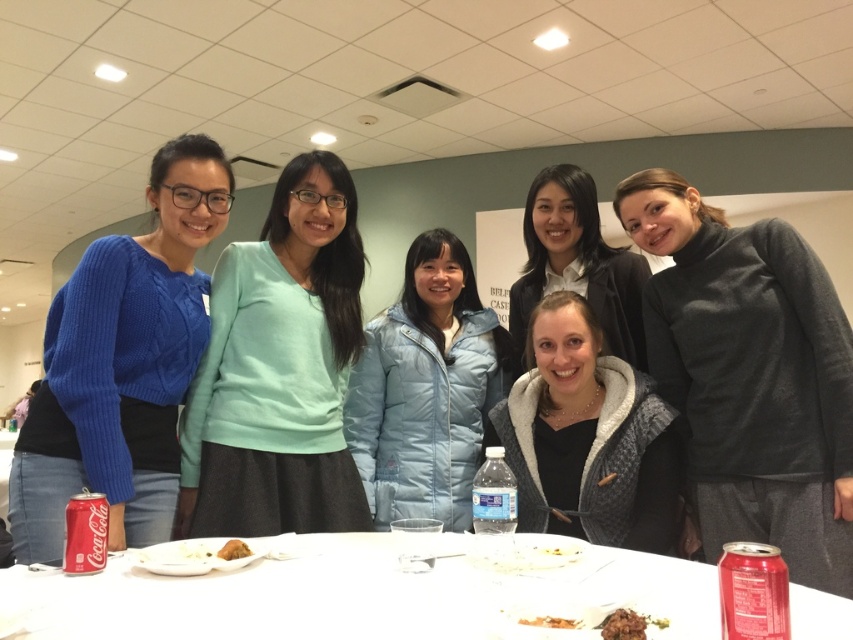
You are trying to identify the person wearing the dark gray turtleneck sweater at center. Based on their position relative to the light blue puffer jacket at center, where would you find them?

The dark gray turtleneck sweater at center is positioned on the right side of the light blue puffer jacket at center, so you would find them to the right of the light blue puffer jacket at center.

You are standing in front of the group of six people. You need to hand a gift to the person wearing the matte white shirt at center. Which direction should you move to reach them first, considering the light blue puffer jacket at center is blocking your view?

The light blue puffer jacket at center is closer to the viewer than the matte white shirt at center. To reach the matte white shirt at center, you should move around the light blue puffer jacket at center since it is blocking the direct path.

You are standing in front of the group and want to hand a gift to the person wearing the dark gray turtleneck sweater at center and the light blue puffer jacket at center. Which person should you approach first to ensure you reach them without needing to move past the other?

You should approach the dark gray turtleneck sweater at center first because they are closer to you than the light blue puffer jacket at center.